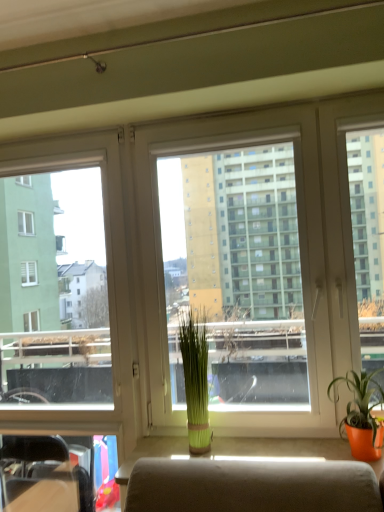
Where is `free space above transparent plastic window screen at center (from a real-world perspective)`? free space above transparent plastic window screen at center (from a real-world perspective) is located at coordinates (250, 110).